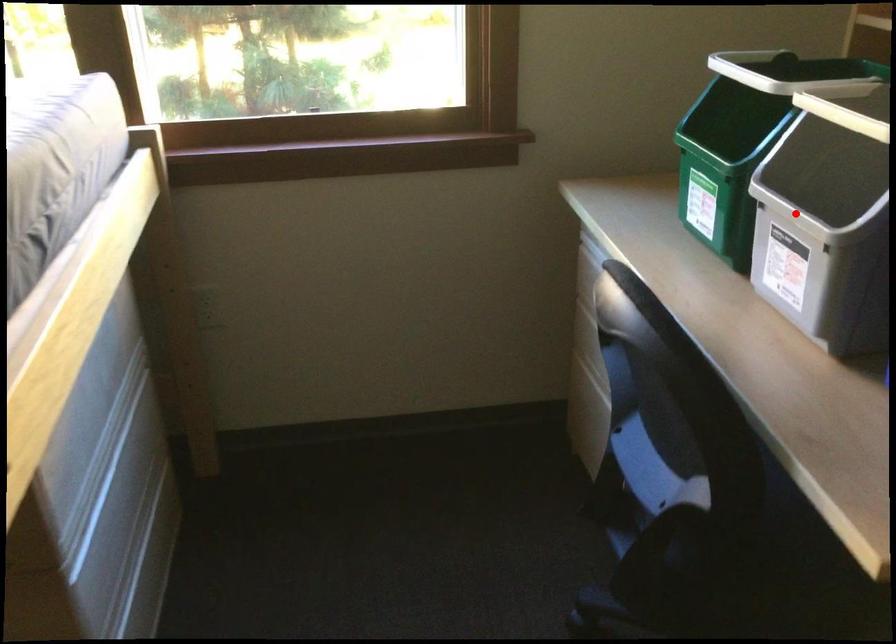
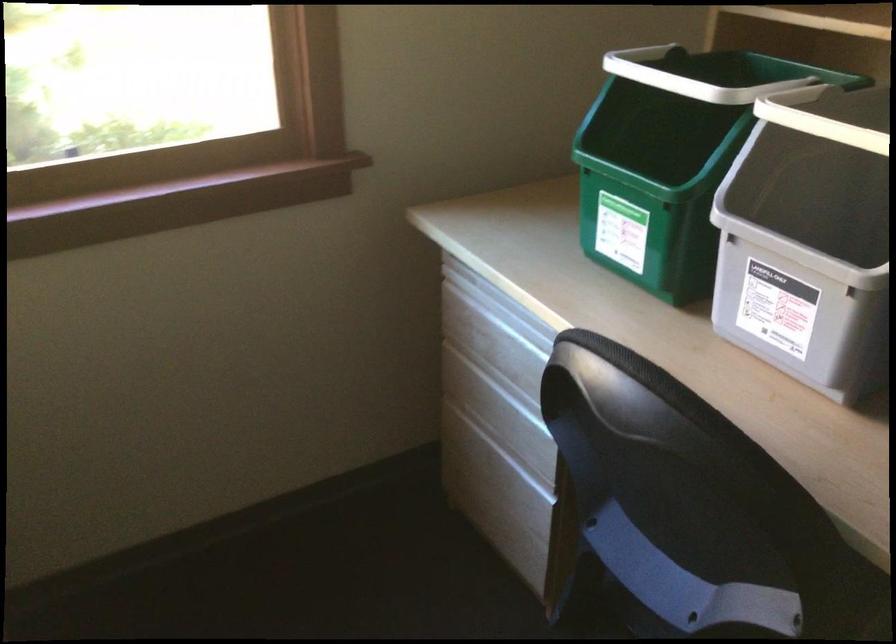
Question: I am providing you with two images of the same scene from different viewpoints. A red point is marked on the first image. At the location where the point appears in image 1, is it still visible in image 2?

Choices:
 (A) Yes
 (B) No

Answer: (A)